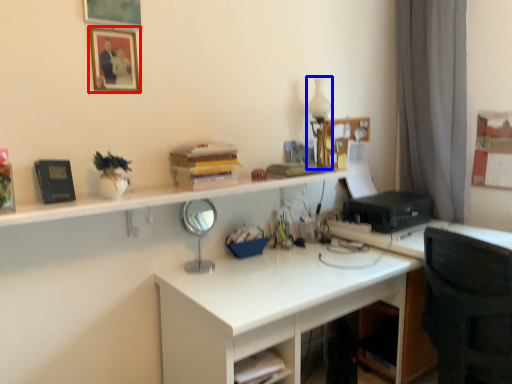
Question: Which object appears closest to the camera in this image, picture frame (highlighted by a red box) or table lamp (highlighted by a blue box)?

Choices:
 (A) picture frame
 (B) table lamp

Answer: (A)